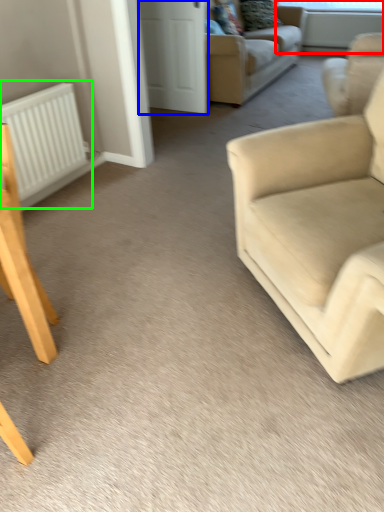
Question: Considering the real-world distances, which object is closest to window screen (highlighted by a red box)? glass door (highlighted by a blue box) or radiator (highlighted by a green box).

Choices:
 (A) glass door
 (B) radiator

Answer: (A)